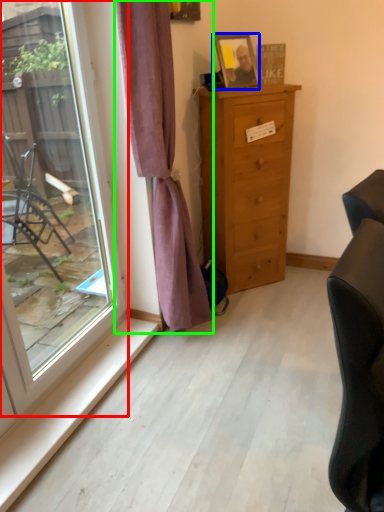
Question: Considering the real-world distances, which object is farthest from window (highlighted by a red box)? picture frame (highlighted by a blue box) or curtain (highlighted by a green box)?

Choices:
 (A) picture frame
 (B) curtain

Answer: (A)